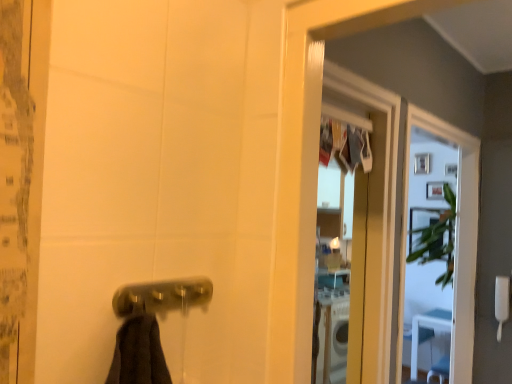
Question: Considering the relative positions of white plastic towel bar at lower left and clear glass screen door at upper right in the image provided, is white plastic towel bar at lower left to the left or to the right of clear glass screen door at upper right?

Choices:
 (A) right
 (B) left

Answer: (A)

Question: From the image's perspective, is white plastic towel bar at lower left located above or below clear glass screen door at upper right?

Choices:
 (A) below
 (B) above

Answer: (A)

Question: Which object is the farthest from the white plastic towel bar at lower left?

Choices:
 (A) polished brass door handle at lower center
 (B) clear glass screen door at upper right

Answer: (A)

Question: Which object is positioned closest to the polished brass door handle at lower center?

Choices:
 (A) clear glass screen door at upper right
 (B) white plastic towel bar at lower left

Answer: (A)